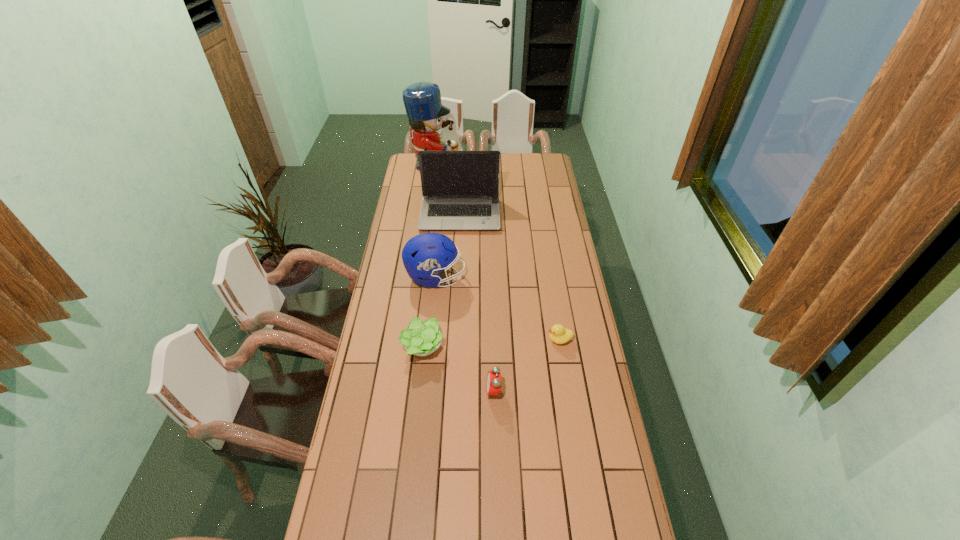
Where is `object at the far edge`? object at the far edge is located at coordinates (422, 100).

Locate an element on the screen. This screenshot has width=960, height=540. nutcracker that is at the left edge is located at coordinates (422, 100).

Locate an element on the screen. laptop computer at the left edge is located at coordinates (460, 189).

At what (x,y) coordinates should I click in order to perform the action: click on football helmet that is at the left edge. Please return your answer as a coordinate pair (x, y). Looking at the image, I should click on (426, 255).

I want to click on lettuce at the left edge, so click(420, 338).

Find the location of a particular element. object located in the right edge section of the desktop is located at coordinates (558, 334).

At what (x,y) coordinates should I click in order to perform the action: click on object located at the far left corner. Please return your answer as a coordinate pair (x, y). Looking at the image, I should click on (422, 100).

At what (x,y) coordinates should I click in order to perform the action: click on free space at the left edge of the desktop. Please return your answer as a coordinate pair (x, y). The image size is (960, 540). Looking at the image, I should click on (374, 320).

Where is `vacant area at the right edge of the desktop`? The image size is (960, 540). vacant area at the right edge of the desktop is located at coordinates (546, 202).

Find the location of a particular element. vacant region between the nutcracker and the third shortest object is located at coordinates (464, 279).